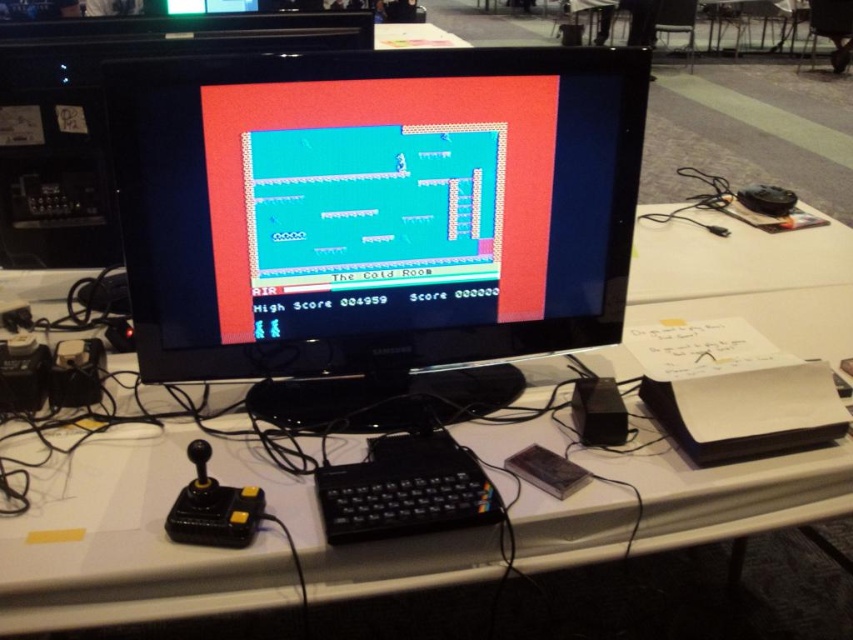
Question: Is white plastic computer desk at center above black plastic keyboard at center?

Choices:
 (A) yes
 (B) no

Answer: (A)

Question: Which object is positioned closest to the black plastic keyboard at center?

Choices:
 (A) white plastic computer desk at center
 (B) black glossy monitor at center

Answer: (A)

Question: Which of the following is the farthest from the observer?

Choices:
 (A) pos(433,513)
 (B) pos(550,324)

Answer: (B)

Question: Can you confirm if black glossy monitor at center is positioned above white plastic computer desk at center?

Choices:
 (A) yes
 (B) no

Answer: (A)

Question: Does black glossy monitor at center appear on the left side of white plastic computer desk at center?

Choices:
 (A) no
 (B) yes

Answer: (B)

Question: Which of the following is the closest to the observer?

Choices:
 (A) (460, 484)
 (B) (44, 490)

Answer: (A)